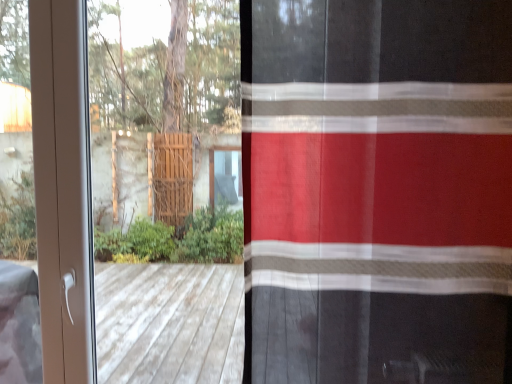
Question: Does red sheer curtain at right turn towards white plastic screen door at left?

Choices:
 (A) no
 (B) yes

Answer: (A)

Question: Is red sheer curtain at right oriented away from white plastic screen door at left?

Choices:
 (A) yes
 (B) no

Answer: (B)

Question: Is red sheer curtain at right wider than white plastic screen door at left?

Choices:
 (A) no
 (B) yes

Answer: (B)

Question: Is red sheer curtain at right not near white plastic screen door at left?

Choices:
 (A) yes
 (B) no

Answer: (B)

Question: Can you confirm if red sheer curtain at right is thinner than white plastic screen door at left?

Choices:
 (A) yes
 (B) no

Answer: (B)

Question: Is white plastic screen door at left a part of red sheer curtain at right?

Choices:
 (A) no
 (B) yes

Answer: (A)

Question: From a real-world perspective, is white plastic screen door at left on top of red sheer curtain at right?

Choices:
 (A) no
 (B) yes

Answer: (A)

Question: Considering the relative positions of white plastic screen door at left and red sheer curtain at right in the image provided, is white plastic screen door at left in front of red sheer curtain at right?

Choices:
 (A) no
 (B) yes

Answer: (A)

Question: From a real-world perspective, is white plastic screen door at left below red sheer curtain at right?

Choices:
 (A) yes
 (B) no

Answer: (A)

Question: Can you confirm if white plastic screen door at left is positioned to the left of red sheer curtain at right?

Choices:
 (A) no
 (B) yes

Answer: (B)

Question: From the image's perspective, is white plastic screen door at left located above red sheer curtain at right?

Choices:
 (A) yes
 (B) no

Answer: (B)

Question: Can you confirm if white plastic screen door at left is bigger than red sheer curtain at right?

Choices:
 (A) no
 (B) yes

Answer: (A)

Question: Does point [87, 130] appear closer or farther from the camera than point [258, 142]?

Choices:
 (A) farther
 (B) closer

Answer: (A)